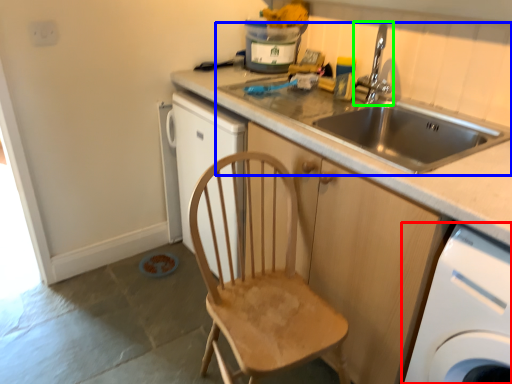
Question: Which object is positioned farthest from home appliance (highlighted by a red box)? Select from sink (highlighted by a blue box) and tap (highlighted by a green box).

Choices:
 (A) sink
 (B) tap

Answer: (B)